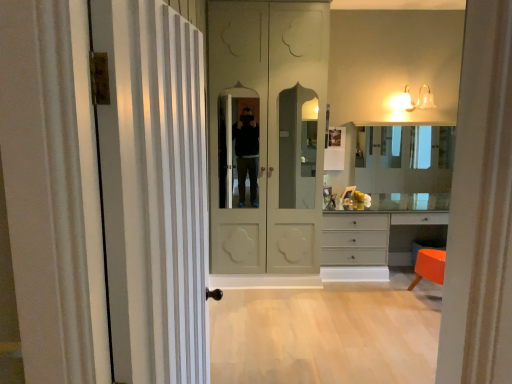
Question: Considering the relative sizes of matte white bell-shaped light fixture at upper right and light wood floor at lower center in the image provided, is matte white bell-shaped light fixture at upper right smaller than light wood floor at lower center?

Choices:
 (A) no
 (B) yes

Answer: (B)

Question: Is the position of matte white bell-shaped light fixture at upper right more distant than that of light wood floor at lower center?

Choices:
 (A) yes
 (B) no

Answer: (A)

Question: Considering the relative positions of matte white bell-shaped light fixture at upper right and light wood floor at lower center in the image provided, is matte white bell-shaped light fixture at upper right to the left of light wood floor at lower center from the viewer's perspective?

Choices:
 (A) no
 (B) yes

Answer: (A)

Question: From the image's perspective, does matte white bell-shaped light fixture at upper right appear higher than light wood floor at lower center?

Choices:
 (A) yes
 (B) no

Answer: (A)

Question: Considering the relative sizes of matte white bell-shaped light fixture at upper right and light wood floor at lower center in the image provided, is matte white bell-shaped light fixture at upper right taller than light wood floor at lower center?

Choices:
 (A) yes
 (B) no

Answer: (A)

Question: Considering the positions of light wood floor at lower center and clear glass mirror at center in the image, is light wood floor at lower center wider or thinner than clear glass mirror at center?

Choices:
 (A) thin
 (B) wide

Answer: (B)

Question: In terms of size, does light wood floor at lower center appear bigger or smaller than clear glass mirror at center?

Choices:
 (A) big
 (B) small

Answer: (A)

Question: From the image's perspective, is light wood floor at lower center located above or below clear glass mirror at center?

Choices:
 (A) above
 (B) below

Answer: (B)

Question: Based on their positions, is light wood floor at lower center located to the left or right of clear glass mirror at center?

Choices:
 (A) left
 (B) right

Answer: (A)

Question: From the image's perspective, is white striped door at left, which is counted as the 1th door, starting from the front, positioned above or below matte cream door at center, which appears as the second door when viewed from the front?

Choices:
 (A) above
 (B) below

Answer: (B)

Question: From a real-world perspective, is white striped door at left, which is counted as the 1th door, starting from the front, positioned above or below matte cream door at center, which appears as the second door when viewed from the front?

Choices:
 (A) above
 (B) below

Answer: (B)

Question: Based on their positions, is white striped door at left, which is counted as the 1th door, starting from the front, located to the left or right of matte cream door at center, which appears as the second door when viewed from the front?

Choices:
 (A) left
 (B) right

Answer: (A)

Question: Is white striped door at left, which is counted as the 1th door, starting from the front, in front of or behind matte cream door at center, which is the first door in back-to-front order, in the image?

Choices:
 (A) behind
 (B) front

Answer: (B)

Question: From a real-world perspective, is matte white bell-shaped light fixture at upper right physically located above or below light wood floor at lower center?

Choices:
 (A) below
 (B) above

Answer: (B)

Question: Considering the positions of matte white bell-shaped light fixture at upper right and light wood floor at lower center in the image, is matte white bell-shaped light fixture at upper right wider or thinner than light wood floor at lower center?

Choices:
 (A) thin
 (B) wide

Answer: (A)